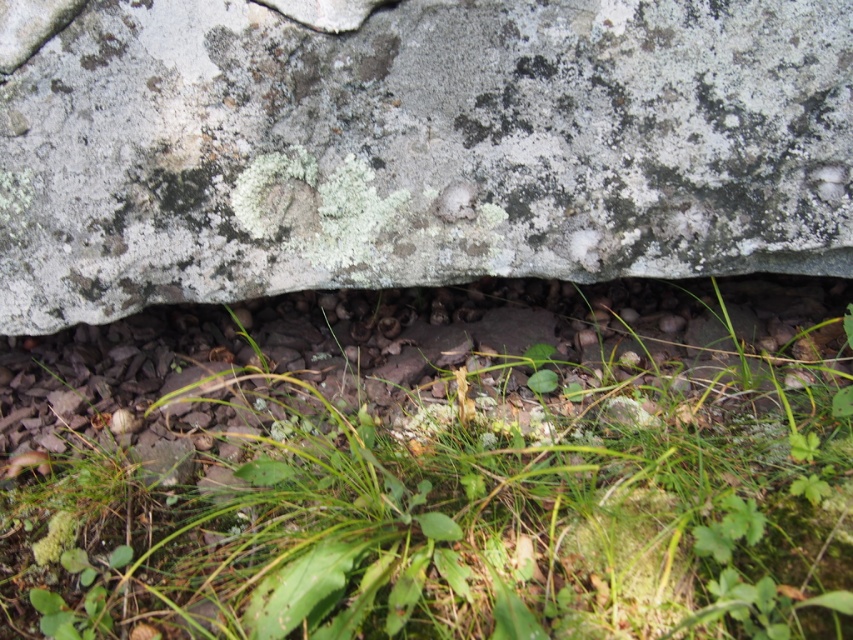
Can you confirm if green leafy grass at center is positioned above gray/rough rock at center?

Incorrect, green leafy grass at center is not positioned above gray/rough rock at center.

This screenshot has width=853, height=640. Identify the location of green leafy grass at center. (431, 472).